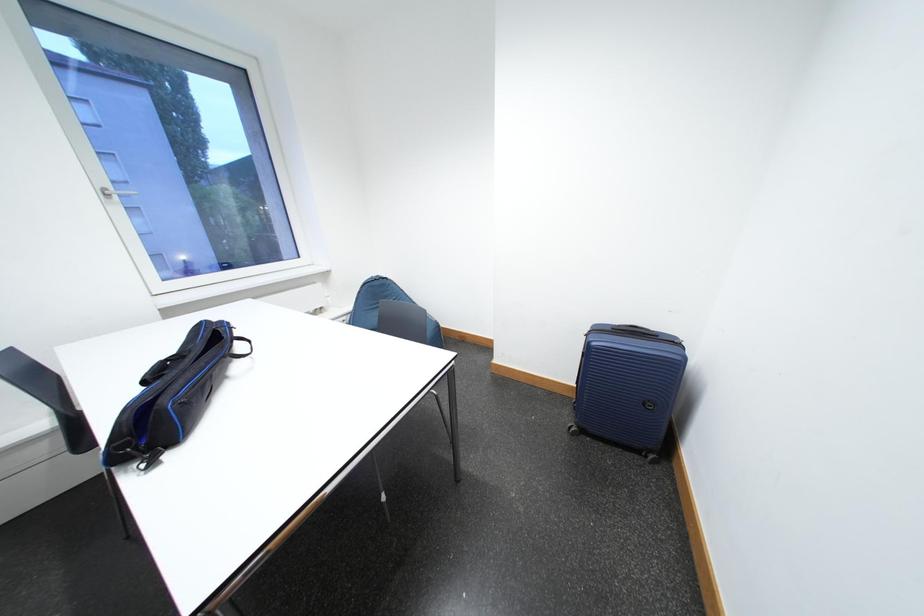
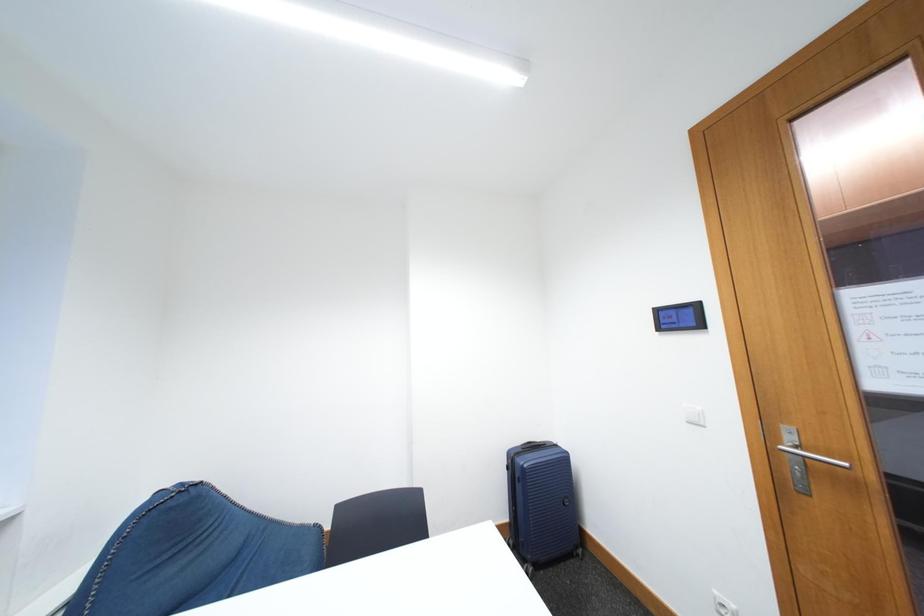
How did the camera likely rotate?

The camera rotated toward right-up.